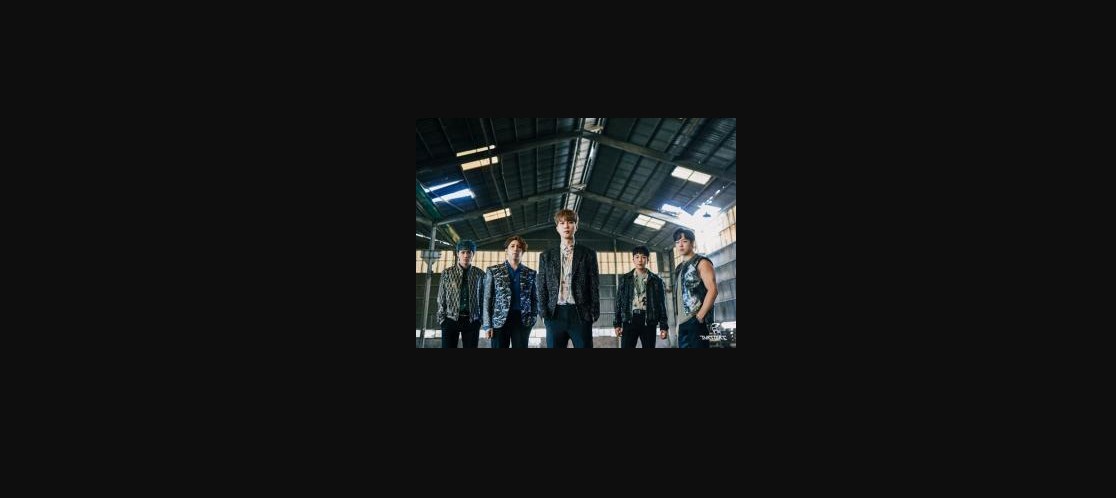
Identify the location of wall. This screenshot has height=498, width=1116. (606, 297), (729, 279).